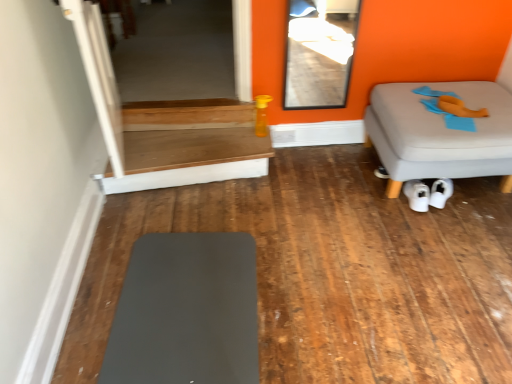
Question: Is transparent glass door at upper center, the 1th glass door viewed from the front, facing towards transparent glass door at upper left, the second glass door viewed from the front?

Choices:
 (A) no
 (B) yes

Answer: (A)

Question: Can you see transparent glass door at upper center, placed as the second glass door when sorted from left to right, touching transparent glass door at upper left, which is the first glass door from left to right?

Choices:
 (A) yes
 (B) no

Answer: (B)

Question: Is transparent glass door at upper center, arranged as the second glass door when viewed from the back, shorter than transparent glass door at upper left, the second glass door viewed from the front?

Choices:
 (A) yes
 (B) no

Answer: (B)

Question: Is transparent glass door at upper center, marked as the 1th glass door in a right-to-left arrangement, not near transparent glass door at upper left, the second glass door viewed from the front?

Choices:
 (A) yes
 (B) no

Answer: (A)

Question: Is transparent glass door at upper center, the 1th glass door viewed from the front, further to camera compared to transparent glass door at upper left, the second glass door viewed from the front?

Choices:
 (A) no
 (B) yes

Answer: (A)

Question: Does transparent glass door at upper center, marked as the 1th glass door in a right-to-left arrangement, have a lesser width compared to transparent glass door at upper left, placed as the 2th glass door when sorted from right to left?

Choices:
 (A) yes
 (B) no

Answer: (A)

Question: Considering the relative sizes of matte gray mat at lower left, marked as the second furniture in a right-to-left arrangement, and white matte sneakers at lower center in the image provided, is matte gray mat at lower left, marked as the second furniture in a right-to-left arrangement, thinner than white matte sneakers at lower center?

Choices:
 (A) no
 (B) yes

Answer: (A)

Question: From a real-world perspective, is matte gray mat at lower left, marked as the second furniture in a right-to-left arrangement, positioned under white matte sneakers at lower center based on gravity?

Choices:
 (A) no
 (B) yes

Answer: (B)

Question: Is matte gray mat at lower left, the first furniture from the front, far away from white matte sneakers at lower center?

Choices:
 (A) yes
 (B) no

Answer: (A)

Question: From the image's perspective, is matte gray mat at lower left, the first furniture from the front, beneath white matte sneakers at lower center?

Choices:
 (A) yes
 (B) no

Answer: (A)

Question: Is matte gray mat at lower left, marked as the first furniture in a left-to-right arrangement, not inside white matte sneakers at lower center?

Choices:
 (A) yes
 (B) no

Answer: (A)

Question: Can you confirm if matte gray mat at lower left, marked as the second furniture in a right-to-left arrangement, is positioned to the left of white matte sneakers at lower center?

Choices:
 (A) no
 (B) yes

Answer: (B)

Question: Does wooden table at center come behind matte gray mat at lower left, the 2th furniture positioned from the back?

Choices:
 (A) yes
 (B) no

Answer: (A)